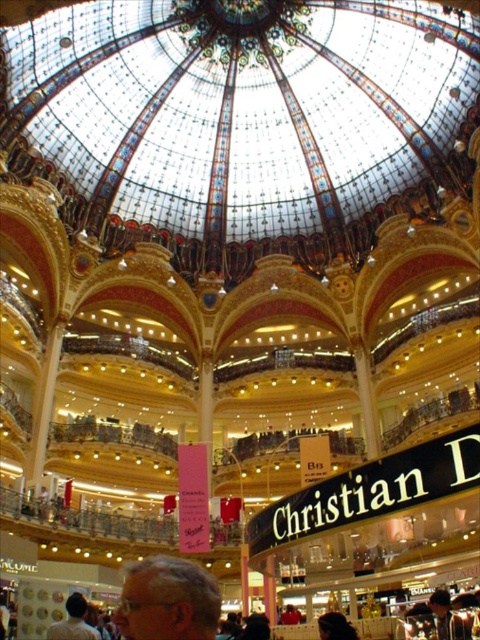
You are a photographer standing in the grand shopping mall and want to capture a photo of the light brown hair at lower center and the smooth brown leather jacket at lower right. Based on their widths, which object should you focus on first to ensure both are in frame?

The light brown hair at lower center might be wider than the smooth brown leather jacket at lower right, so focusing on the light brown hair at lower center first would ensure both fit within the frame.

You are a photographer standing in the grand shopping mall and want to take a photo of both the light brown hair at lower center and the light brown leather jacket at lower left. However, you notice that one of them might be blocking the other in your shot. Which object is positioned in front, and will you need to adjust your angle to capture both clearly?

The light brown hair at lower center is in front of the light brown leather jacket at lower left, so you will need to adjust your angle to ensure both are visible in the photo.

Based on the photo, you are a photographer standing in the grand shopping mall and want to take a photo of both the light brown hair at lower center and the light brown leather jacket at lower left. Given their distance, can you capture both in a single frame without moving your camera?

The light brown hair at lower center and light brown leather jacket at lower left are 23.15 meters apart. Depending on the camera lens used, a wide angle or zoom lens may be necessary to capture both in a single frame without moving the camera.